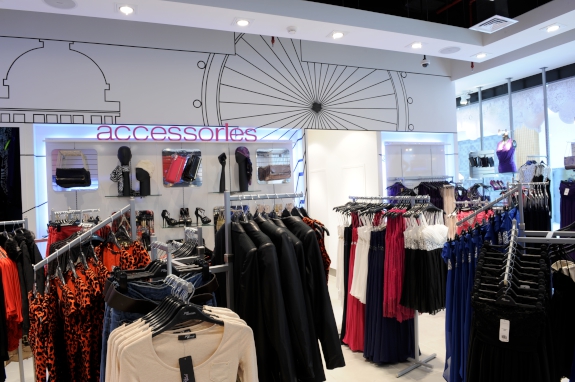
Find the location of a particular element. The image size is (575, 382). ceiling light is located at coordinates (128, 15), (245, 19), (338, 38), (419, 44), (484, 54), (557, 26).